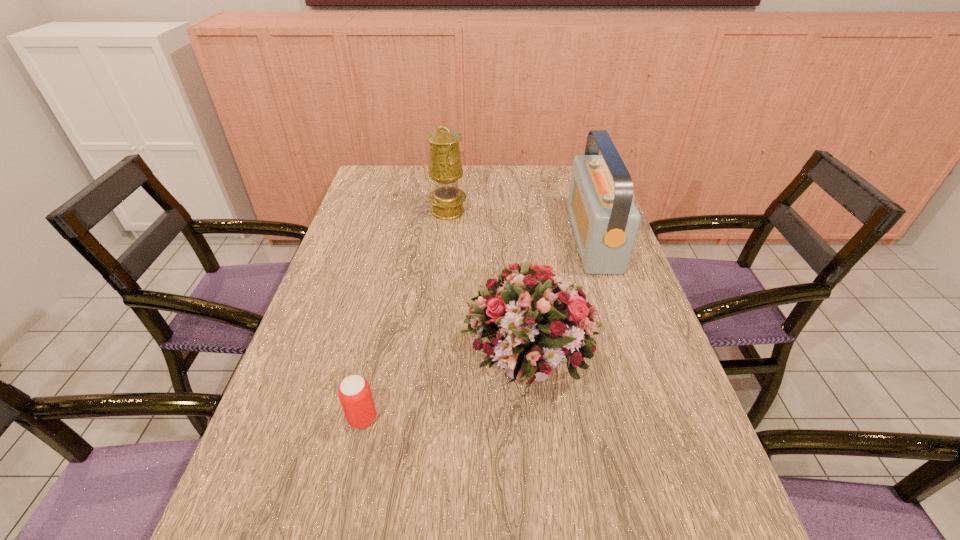
Locate an element on the screen. Image resolution: width=960 pixels, height=540 pixels. the second object from left to right is located at coordinates (445, 168).

Identify the location of the rightmost object. (605, 220).

The height and width of the screenshot is (540, 960). In order to click on the third object from left to right in this screenshot , I will do `click(534, 319)`.

Where is `the leftmost object`? This screenshot has width=960, height=540. the leftmost object is located at coordinates (354, 392).

Image resolution: width=960 pixels, height=540 pixels. In order to click on beer can in this screenshot , I will do `click(354, 392)`.

Where is `blank space located on the back of the second object from left to right`? Image resolution: width=960 pixels, height=540 pixels. blank space located on the back of the second object from left to right is located at coordinates (x=451, y=180).

Image resolution: width=960 pixels, height=540 pixels. In order to click on free space located on the front-facing side of the rightmost object in this screenshot , I will do `click(468, 239)`.

The image size is (960, 540). In order to click on vacant space situated 0.390m on the front-facing side of the rightmost object in this screenshot , I will do `click(449, 239)`.

I want to click on vacant space positioned on the front-facing side of the rightmost object, so click(516, 239).

The image size is (960, 540). In order to click on vacant space located on the back of the third object from left to right in this screenshot , I will do `click(521, 303)`.